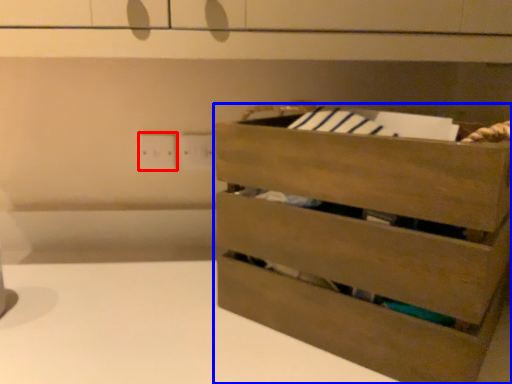
Question: Among these objects, which one is farthest to the camera, electric outlet (highlighted by a red box) or chest of drawers (highlighted by a blue box)?

Choices:
 (A) electric outlet
 (B) chest of drawers

Answer: (A)